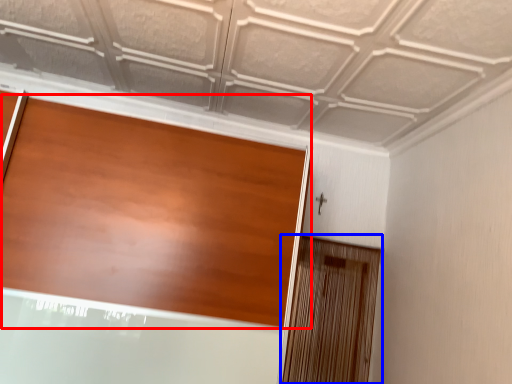
Question: Which object is closer to the camera taking this photo, door (highlighted by a red box) or screen door (highlighted by a blue box)?

Choices:
 (A) door
 (B) screen door

Answer: (A)